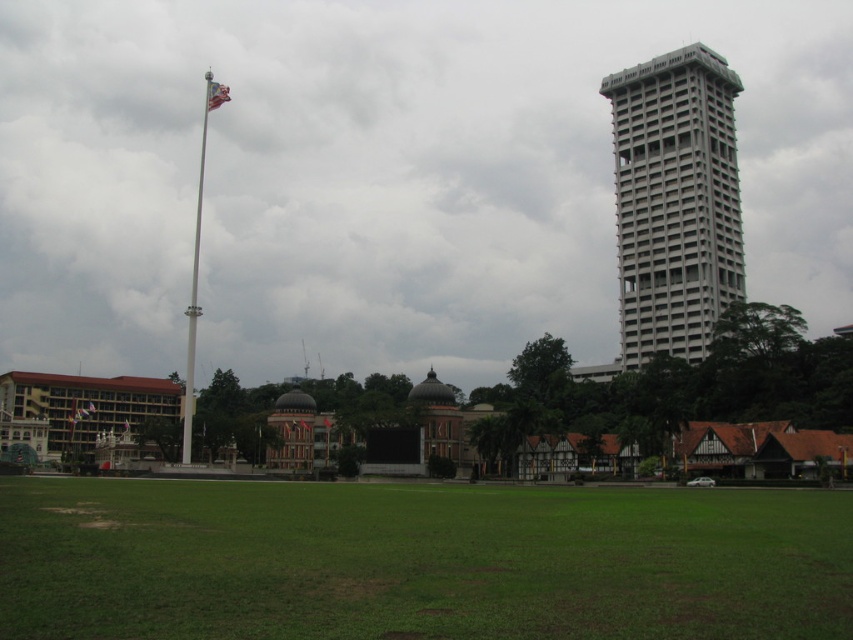
You are standing at the edge of the green grass at lower center and want to look up to see the silvery metallic flag at upper left. Which object is closer to your eyes?

The green grass at lower center is closer to your eyes because you are standing on it, while the silvery metallic flag at upper left is further away in the distance.

You are a gardener who wants to plant a new tree in the green grass at lower center. Considering the height of the silvery metallic flag at upper left, do you think the tree will grow taller than the flag?

The green grass at lower center has a lesser height compared to the silvery metallic flag at upper left. Since the grass is shorter, the tree might grow taller than the flag, but this depends on the tree species and growth potential. However, based on the current height comparison, the flag is taller than the grass, so if the tree can surpass the flagpole height, it could grow taller.